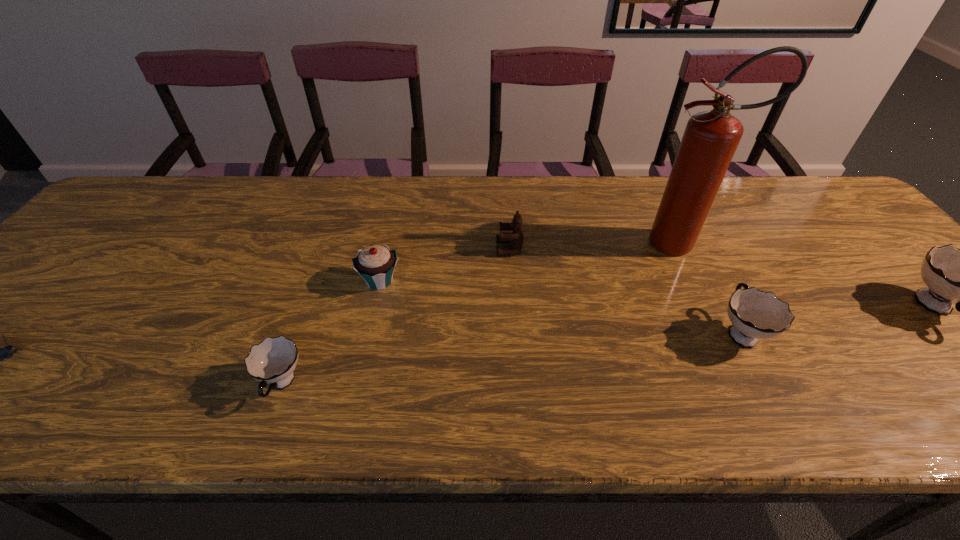
If we want them evenly spaced by inserting an extra cup among them, please locate a free spot for this new cup. Please provide its 2D coordinates. Your answer should be formatted as a tuple, i.e. [(x, y)], where the tuple contains the x and y coordinates of a point satisfying the conditions above.

[(522, 356)]